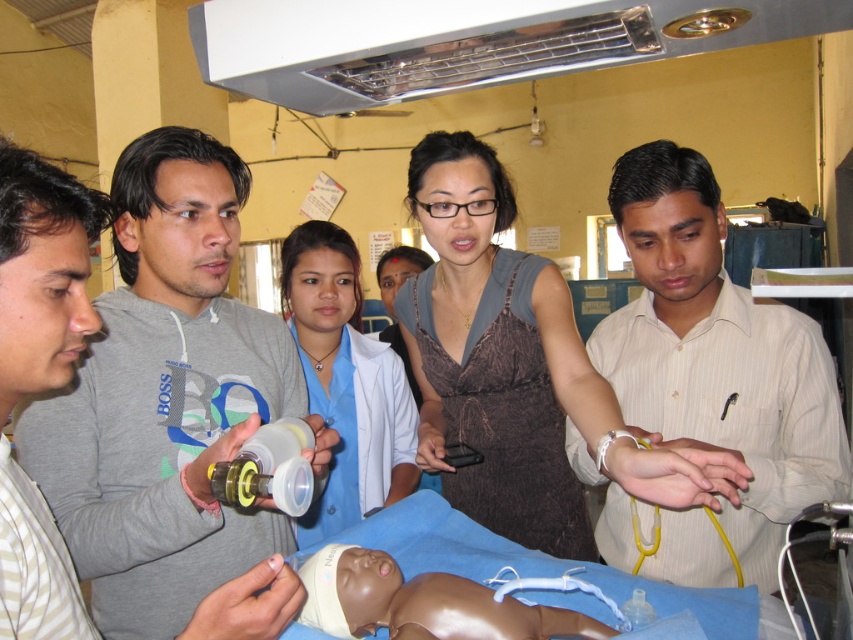
You are a trainee in the medical room and need to locate two specific points marked in the scene. The first point is at coordinates point (x=628, y=550) and the second is at point (x=556, y=616). From your perspective standing in the room, which point is closer to you?

Point (x=556, y=616) is closer to you because it is in front of point (x=628, y=550).

You are a medical student standing in the room. You need to grab a stethoscope from the white striped shirt at center. Can you reach it without moving closer?

The white striped shirt at center is 33.77 inches away from the viewer, so yes, you can reach it without moving closer.